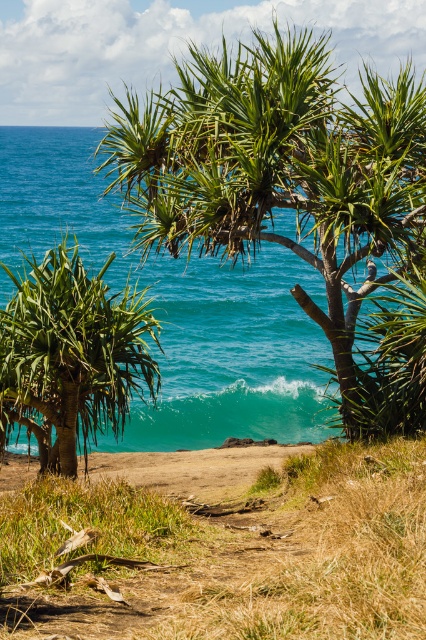
Question: Is the position of teal glossy water at center more distant than that of green leafy palm tree at center?

Choices:
 (A) yes
 (B) no

Answer: (A)

Question: Is teal glossy water at center positioned behind green leafy palm tree at center?

Choices:
 (A) no
 (B) yes

Answer: (B)

Question: Considering the relative positions of teal glossy water at center and green leafy palm tree at center in the image provided, where is teal glossy water at center located with respect to green leafy palm tree at center?

Choices:
 (A) left
 (B) right

Answer: (A)

Question: Among these points, which one is nearest to the camera?

Choices:
 (A) pyautogui.click(x=0, y=376)
 (B) pyautogui.click(x=78, y=182)

Answer: (A)

Question: Which point is farther from the camera taking this photo?

Choices:
 (A) (290, 257)
 (B) (97, 381)

Answer: (A)

Question: Which point is closer to the camera?

Choices:
 (A) green leafy palm tree at center
 (B) teal glossy water at center

Answer: (A)